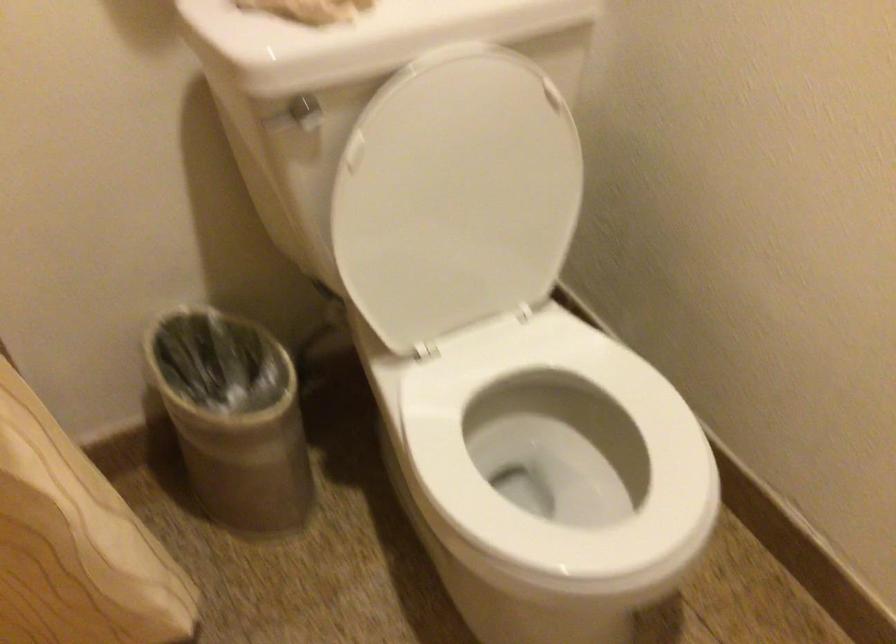
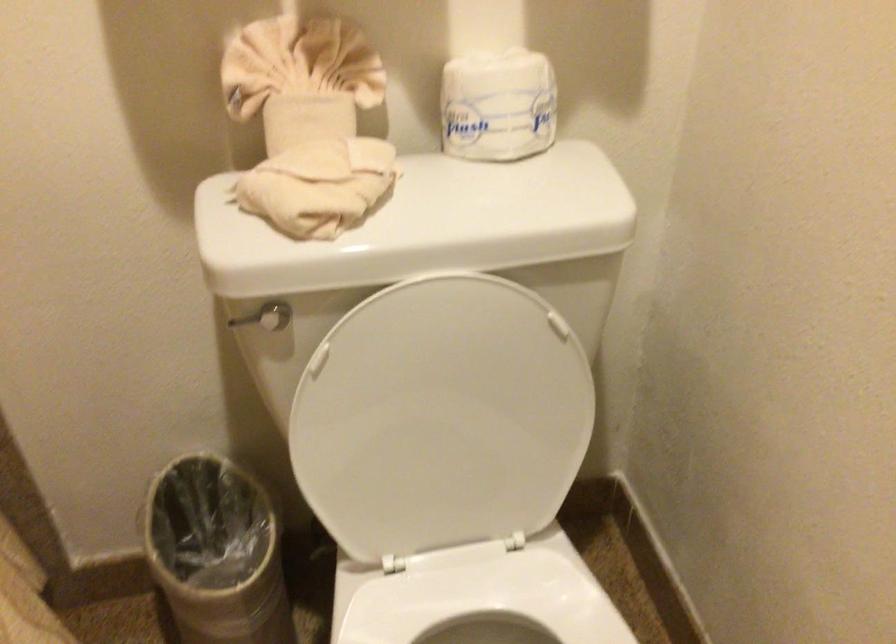
Question: The camera is either moving clockwise (left) or counter-clockwise (right) around the object. The first image is from the beginning of the video and the second image is from the end. Is the camera moving left or right when shooting the video?

Choices:
 (A) Left
 (B) Right

Answer: (B)